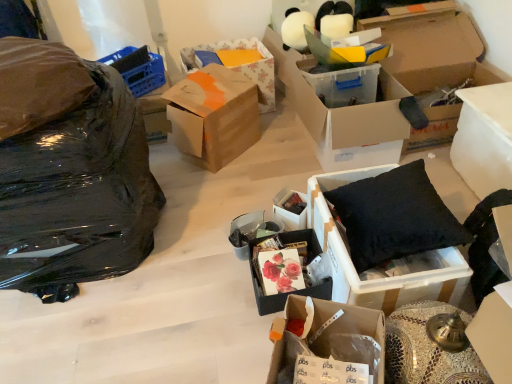
Image resolution: width=512 pixels, height=384 pixels. I want to click on vacant space to the left of black fabric cushion at right, positioned as the 6th box in left-to-right order, so click(229, 300).